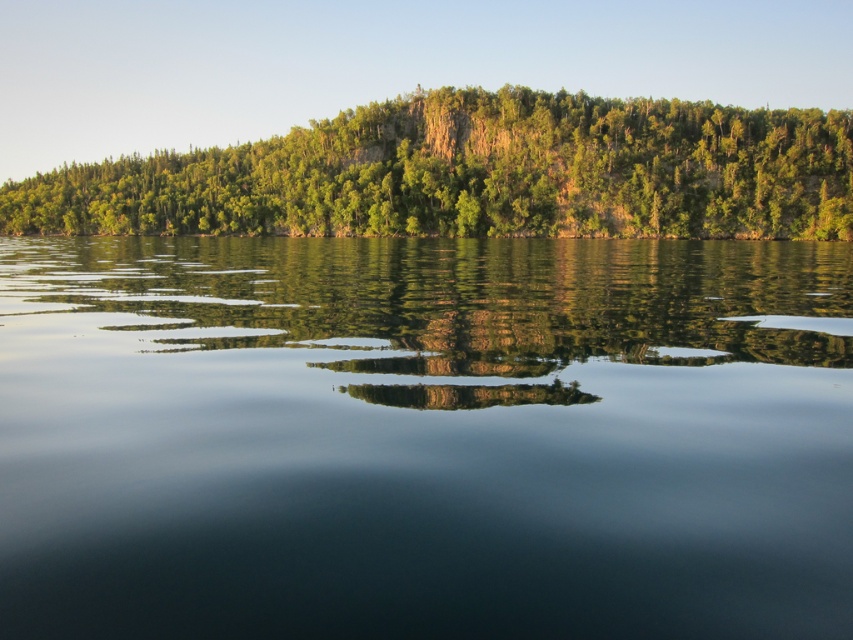
You are an environmental scientist assessing the landscape. You need to determine which area is wider between the green reflective water at center and the green leafy trees at upper center. Based on the scene, which one is narrower?

The green reflective water at center is narrower than the green leafy trees at upper center.

You are standing at the edge of the green reflective water at center and looking towards the green leafy trees at upper center. Which object is closer to you?

The green reflective water at center is closer to you because it is in front of the green leafy trees at upper center.

You are standing at the edge of the green reflective water at center and want to see the green leafy trees at upper center. Which direction should you look to see them?

The green leafy trees at upper center are taller than the green reflective water at center, so you should look upward to see them.